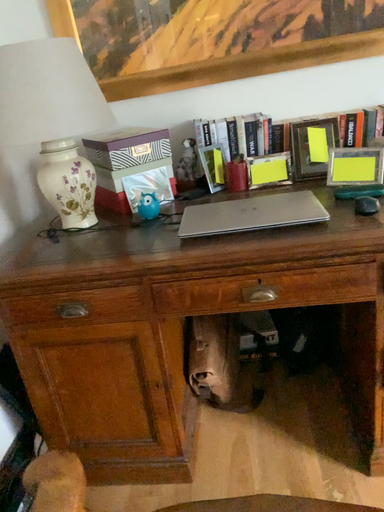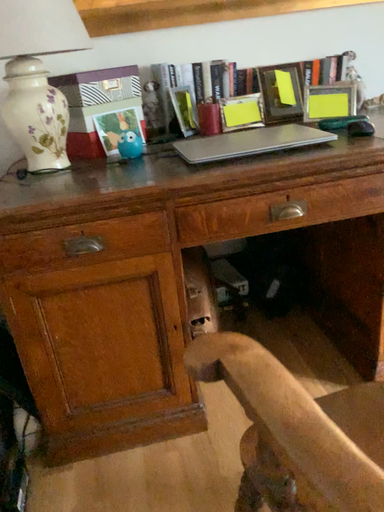
Question: How did the camera likely rotate when shooting the video?

Choices:
 (A) rotated right
 (B) rotated left

Answer: (A)